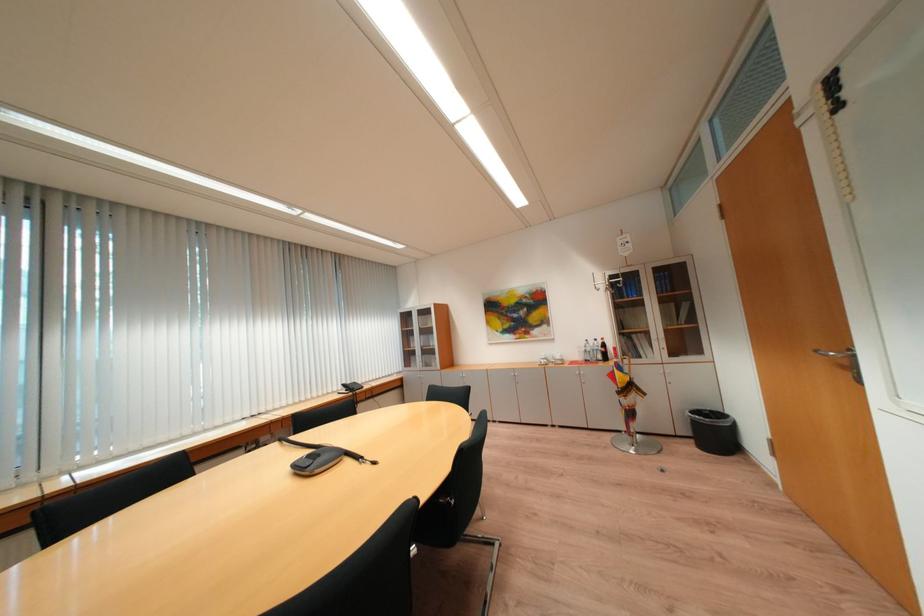
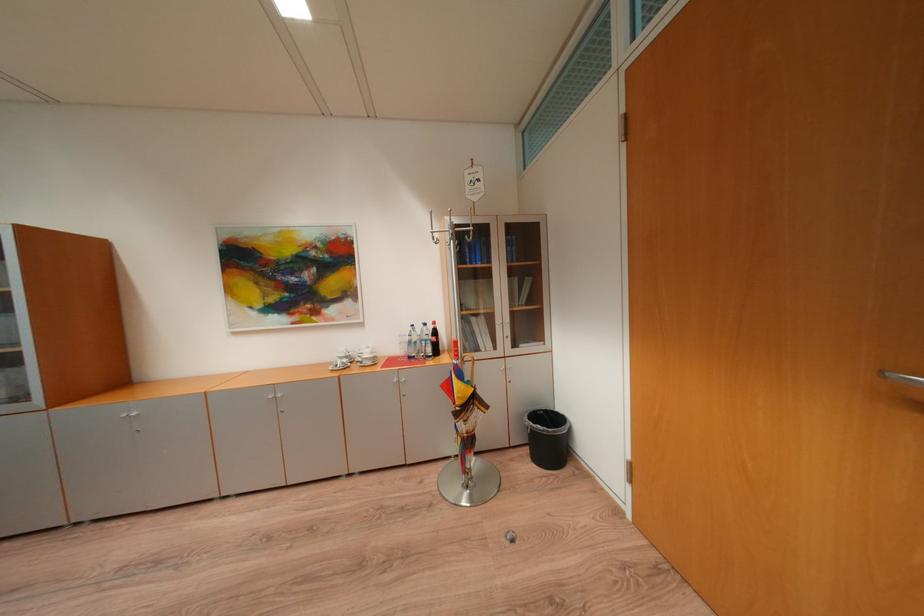
Locate, in the second image, the point that corresponds to the point at 604,341 in the first image.

(434, 326)